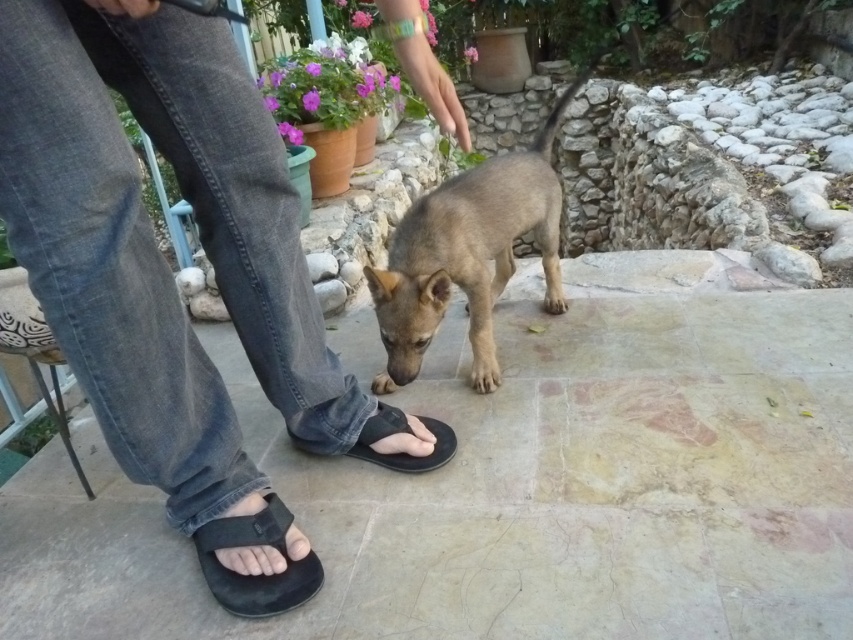
Question: Is denim jeans at lower left above black fabric sandal at lower left?

Choices:
 (A) no
 (B) yes

Answer: (B)

Question: Which point appears closest to the camera in this image?

Choices:
 (A) (515, 188)
 (B) (445, 435)

Answer: (B)

Question: Can you confirm if fuzzy brown dog at center is positioned to the right of black fabric sandal at lower center?

Choices:
 (A) yes
 (B) no

Answer: (A)

Question: Does fuzzy brown dog at center have a greater width compared to black fabric sandal at lower center?

Choices:
 (A) no
 (B) yes

Answer: (B)

Question: Which is farther from the denim jeans at lower left?

Choices:
 (A) black fabric sandal at lower left
 (B) black fabric sandal at lower center
 (C) fuzzy brown dog at center

Answer: (C)

Question: Estimate the real-world distances between objects in this image. Which object is farther from the fuzzy brown dog at center?

Choices:
 (A) black fabric sandal at lower center
 (B) denim jeans at lower left
 (C) black fabric sandal at lower left

Answer: (C)